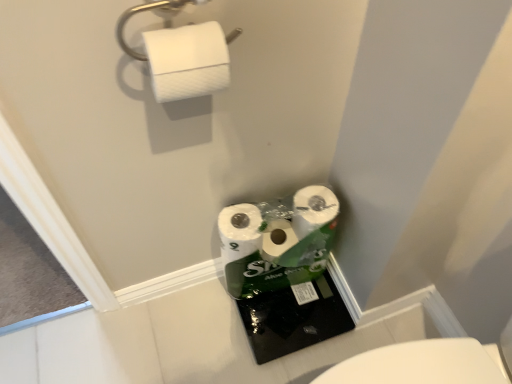
Question: Is white textured toilet paper at upper left bigger or smaller than white matte paper towel at upper left?

Choices:
 (A) big
 (B) small

Answer: (A)

Question: Is white textured toilet paper at upper left inside or outside of white matte paper towel at upper left?

Choices:
 (A) outside
 (B) inside

Answer: (A)

Question: In terms of width, does white textured toilet paper at upper left look wider or thinner when compared to white matte paper towel at upper left?

Choices:
 (A) wide
 (B) thin

Answer: (A)

Question: From a real-world perspective, is white matte paper towel at upper left physically located above or below white textured toilet paper at upper left?

Choices:
 (A) above
 (B) below

Answer: (A)

Question: From the image's perspective, is white matte paper towel at upper left located above or below white textured toilet paper at upper left?

Choices:
 (A) below
 (B) above

Answer: (B)

Question: Is point (145, 3) closer or farther from the camera than point (199, 44)?

Choices:
 (A) closer
 (B) farther

Answer: (B)

Question: Based on their sizes in the image, would you say white matte paper towel at upper left is bigger or smaller than white textured toilet paper at upper left?

Choices:
 (A) small
 (B) big

Answer: (A)